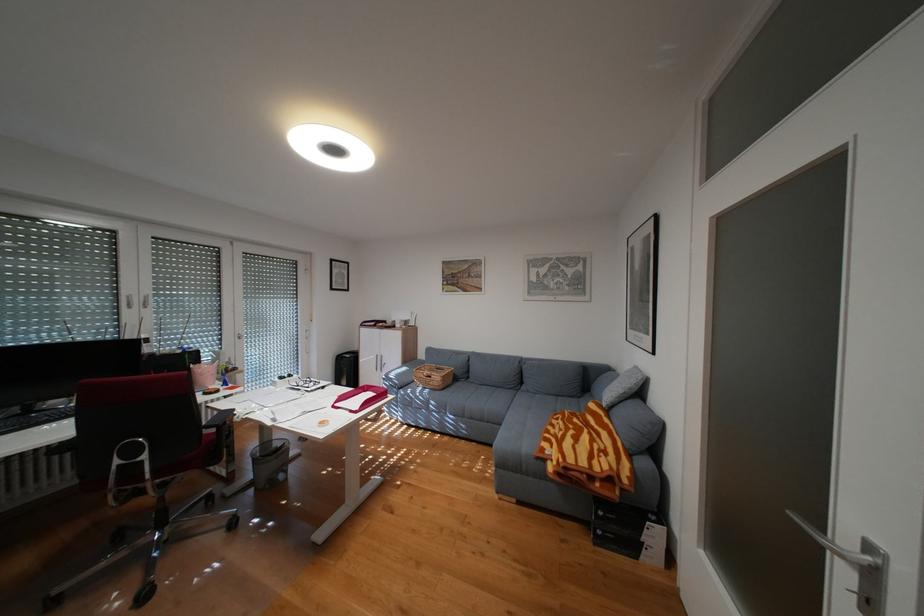
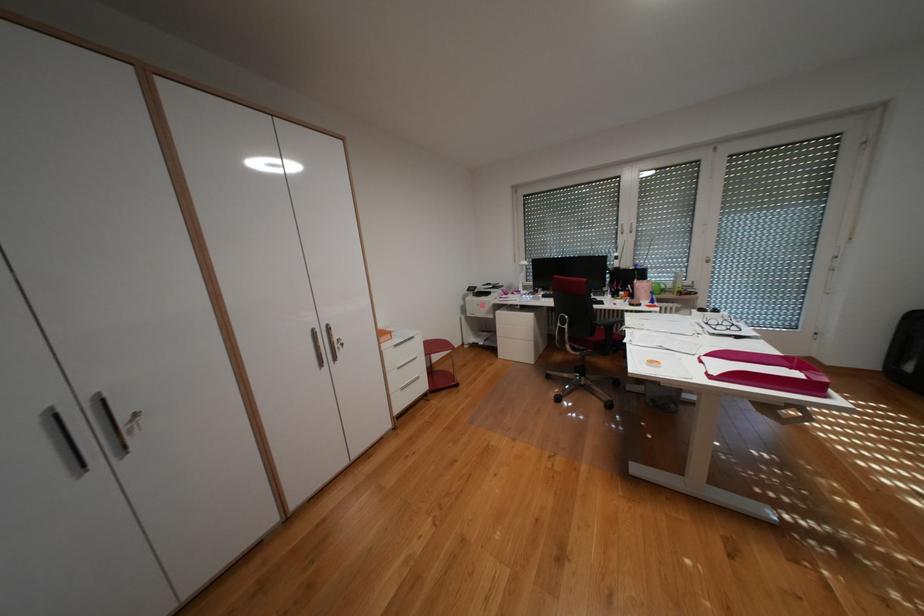
Question: I am providing you with two images of the same scene from different viewpoints. After the viewpoint changes to image2, which objects are now occluded?

Choices:
 (A) silver cabinet handle
 (B) mesh trash can
 (C) pink sticky note
 (D) chair armrest

Answer: (B)